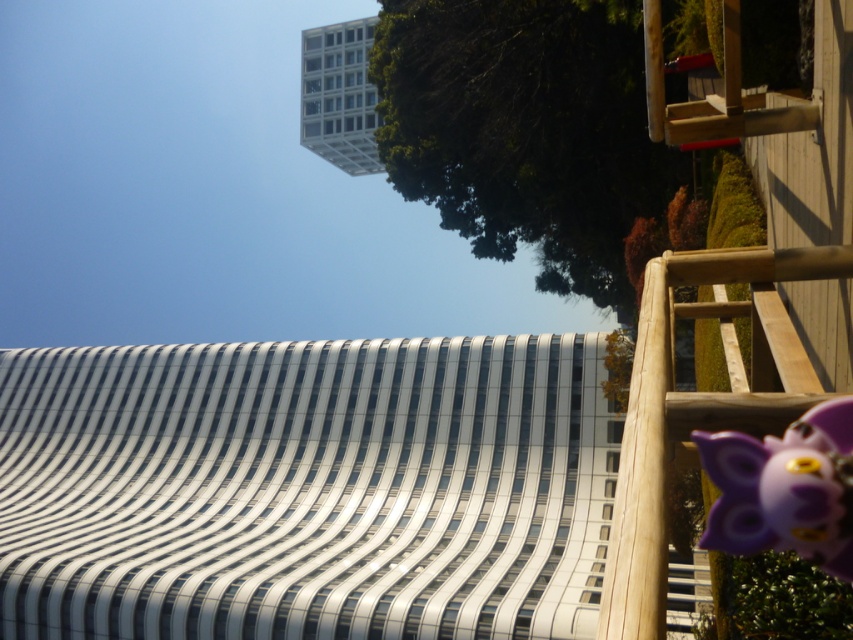
Question: Is green leafy tree at upper center thinner than purple matte toy at lower right?

Choices:
 (A) no
 (B) yes

Answer: (A)

Question: Is green leafy tree at upper center behind purple matte toy at lower right?

Choices:
 (A) yes
 (B) no

Answer: (A)

Question: Can you confirm if green leafy tree at upper center is positioned below purple matte toy at lower right?

Choices:
 (A) yes
 (B) no

Answer: (B)

Question: Which object is farther from the camera taking this photo?

Choices:
 (A) purple matte toy at lower right
 (B) green leafy tree at upper center

Answer: (B)